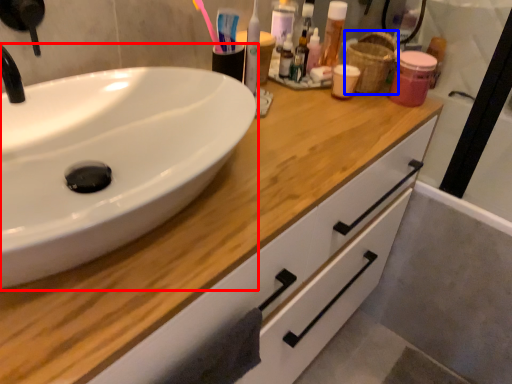
Question: Which point is further to the camera, sink (highlighted by a red box) or basket (highlighted by a blue box)?

Choices:
 (A) sink
 (B) basket

Answer: (B)